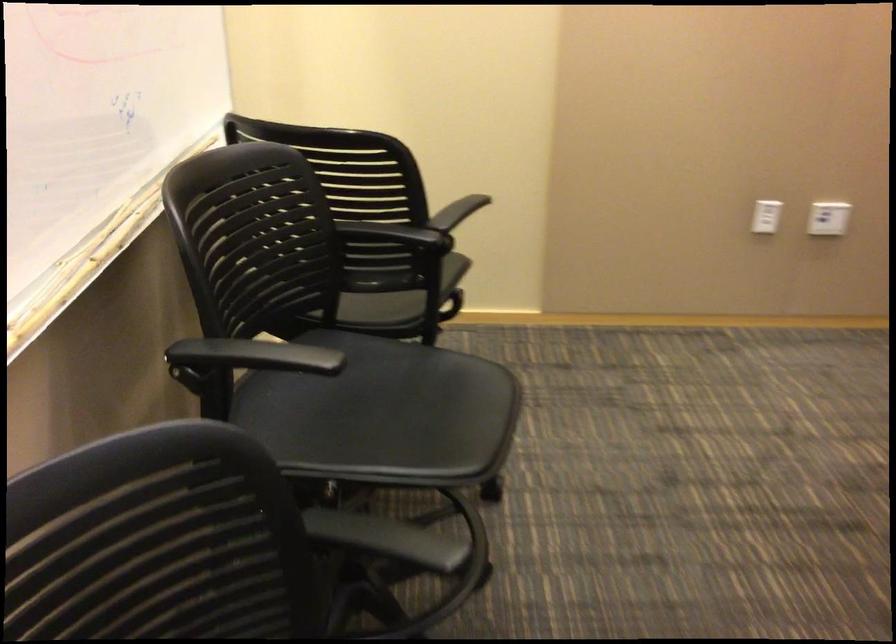
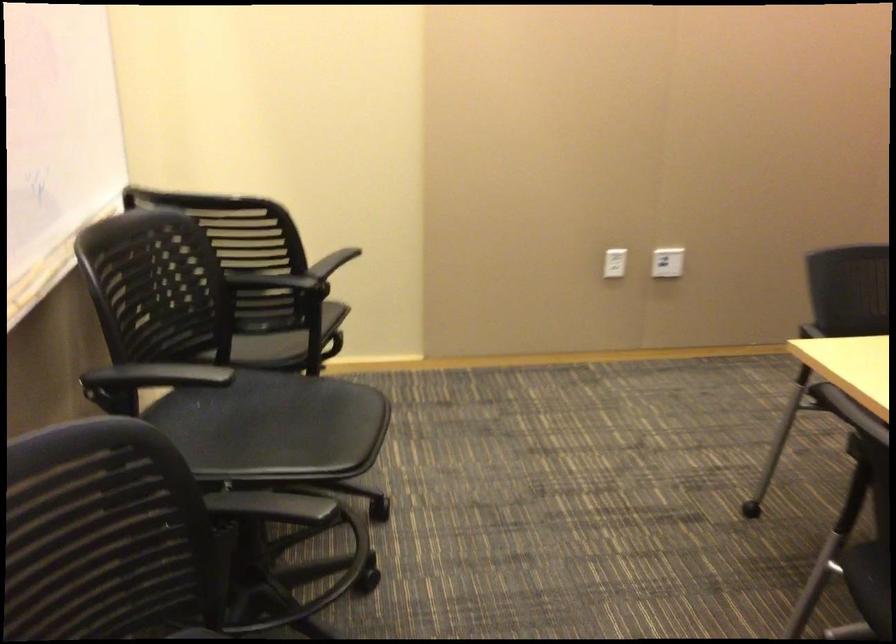
Question: The images are taken continuously from a first-person perspective. In which direction are you moving?

Choices:
 (A) Left
 (B) Right
 (C) Forward
 (D) Backward

Answer: (D)